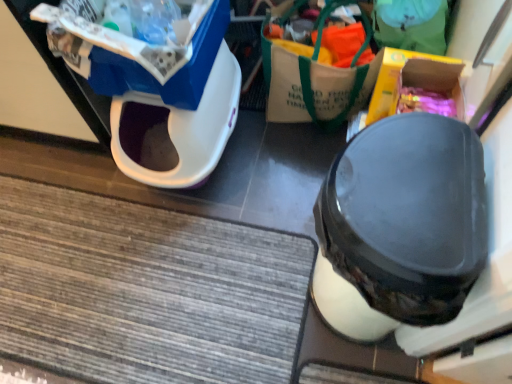
Question: From the image's perspective, would you say yellow cardboard box at upper right, the 2th storage box when ordered from left to right, is shown under white plastic litter bin at upper left?

Choices:
 (A) no
 (B) yes

Answer: (A)

Question: Does yellow cardboard box at upper right, which is counted as the 1th storage box, starting from the right, contain white plastic litter bin at upper left?

Choices:
 (A) yes
 (B) no

Answer: (B)

Question: Does yellow cardboard box at upper right, which is counted as the 1th storage box, starting from the right, have a greater width compared to white plastic litter bin at upper left?

Choices:
 (A) no
 (B) yes

Answer: (A)

Question: Can you confirm if yellow cardboard box at upper right, which is counted as the 1th storage box, starting from the right, is shorter than white plastic litter bin at upper left?

Choices:
 (A) no
 (B) yes

Answer: (B)

Question: Is yellow cardboard box at upper right, which is counted as the 1th storage box, starting from the right, located outside white plastic litter bin at upper left?

Choices:
 (A) yes
 (B) no

Answer: (A)

Question: From the image's perspective, is black matte shoe at center positioned above or below white plastic litter bin at upper left?

Choices:
 (A) above
 (B) below

Answer: (B)

Question: Considering the positions of point (339, 306) and point (206, 145), is point (339, 306) closer or farther from the camera than point (206, 145)?

Choices:
 (A) farther
 (B) closer

Answer: (B)

Question: Considering their positions, is black matte shoe at center located in front of or behind white plastic litter bin at upper left?

Choices:
 (A) behind
 (B) front

Answer: (B)

Question: Looking at the image, does black matte shoe at center seem bigger or smaller compared to white plastic litter bin at upper left?

Choices:
 (A) big
 (B) small

Answer: (A)

Question: From the image's perspective, is black matte shoe at center positioned above or below blue plastic storage box at upper left, the second storage box from the right?

Choices:
 (A) below
 (B) above

Answer: (A)

Question: Considering the positions of point (422, 122) and point (184, 99), is point (422, 122) closer or farther from the camera than point (184, 99)?

Choices:
 (A) closer
 (B) farther

Answer: (A)

Question: Is black matte shoe at center spatially inside blue plastic storage box at upper left, placed as the 1th storage box when sorted from left to right, or outside of it?

Choices:
 (A) inside
 (B) outside

Answer: (B)

Question: From their relative heights in the image, would you say black matte shoe at center is taller or shorter than blue plastic storage box at upper left, the second storage box from the right?

Choices:
 (A) tall
 (B) short

Answer: (A)

Question: In the image, is white plastic litter bin at upper left on the left side or the right side of black matte shoe at center?

Choices:
 (A) left
 (B) right

Answer: (A)

Question: Is point (210, 74) positioned closer to the camera than point (399, 175)?

Choices:
 (A) farther
 (B) closer

Answer: (A)